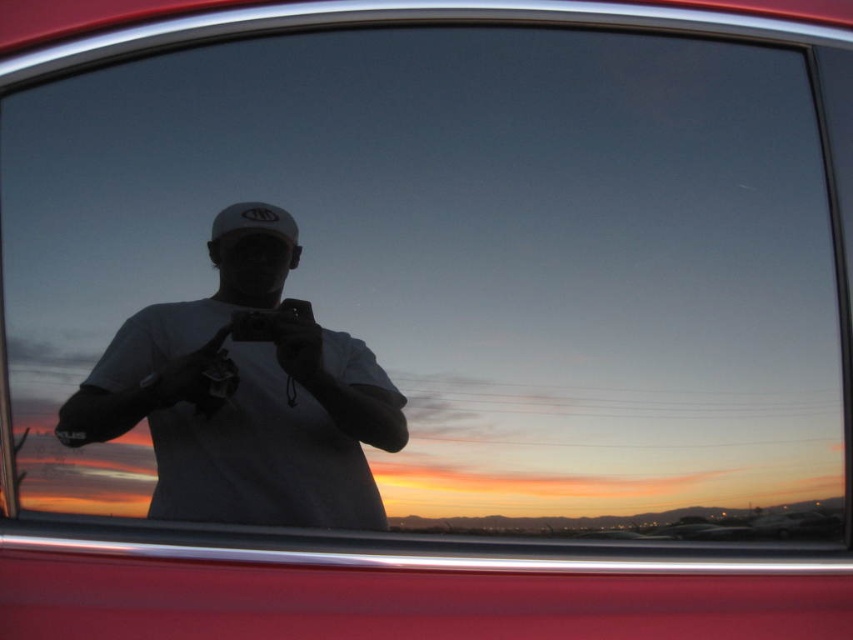
You are trying to determine which object is larger between the white matte shirt at center and the white matte baseball hat at center in the reflection on the car window. Based on the reflection, which one appears larger?

The white matte shirt at center appears larger than the white matte baseball hat at center in the reflection.

You are inside the red vehicle and looking through the window. There are two points marked on the window at coordinates point (x=329, y=445) and point (x=228, y=214). Which point is closer to you?

Point (x=329, y=445) is closer to the viewer than point (x=228, y=214).